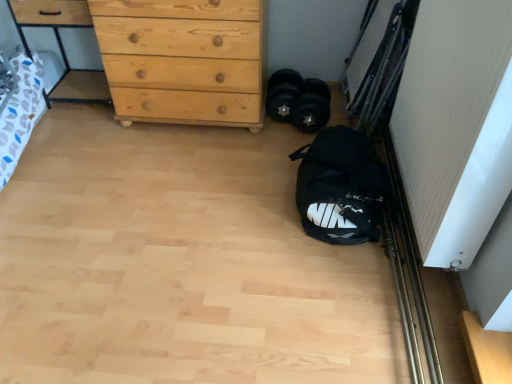
Where is `vacant area that is in front of natural wood dresser at upper left`? The width and height of the screenshot is (512, 384). vacant area that is in front of natural wood dresser at upper left is located at coordinates (73, 128).